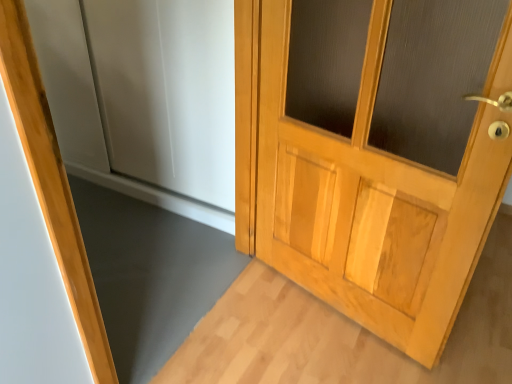
What is the approximate height of light brown wooden door at right?

4.19 feet.

At what (x,y) coordinates should I click in order to perform the action: click on light brown wooden door at right. Please return your answer as a coordinate pair (x, y). The image size is (512, 384). Looking at the image, I should click on (374, 152).

The image size is (512, 384). What do you see at coordinates (374, 152) in the screenshot? I see `light brown wooden door at right` at bounding box center [374, 152].

The height and width of the screenshot is (384, 512). I want to click on light brown wooden door at right, so [x=374, y=152].